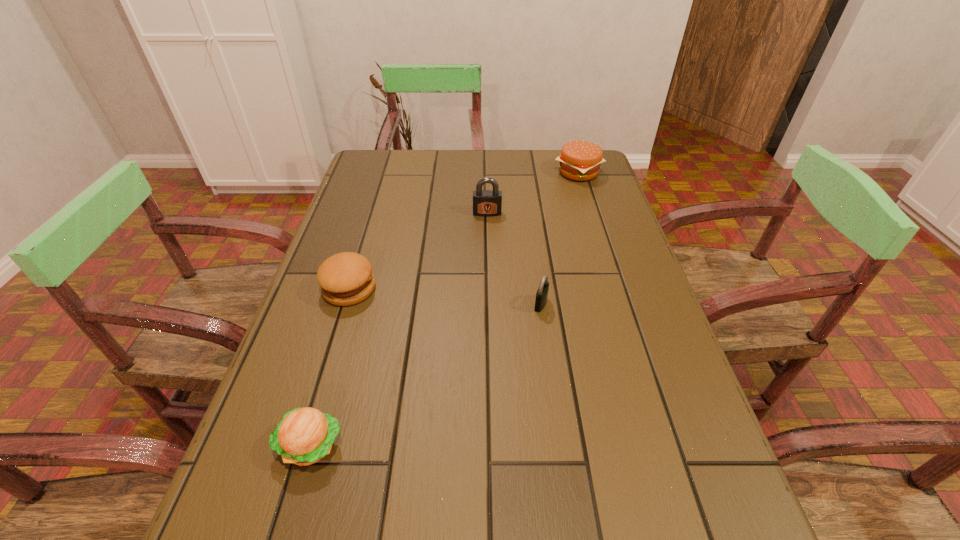
This screenshot has width=960, height=540. Identify the location of the taller padlock. (486, 203).

This screenshot has width=960, height=540. Identify the location of the left padlock. (486, 203).

Identify the location of the rightmost hamburger. The image size is (960, 540). (580, 160).

The image size is (960, 540). I want to click on the farthest object, so click(580, 160).

Where is `the second nearest hamburger`? The height and width of the screenshot is (540, 960). the second nearest hamburger is located at coordinates (346, 278).

Where is `the nearer padlock`? Image resolution: width=960 pixels, height=540 pixels. the nearer padlock is located at coordinates (542, 293).

Identify the location of the right padlock. (542, 293).

Locate an element on the screen. This screenshot has width=960, height=540. the nearest hamburger is located at coordinates (304, 436).

Identify the location of vacant area situated on the front of the second farthest object near the keyhole. This screenshot has height=540, width=960. (488, 239).

Locate an element on the screen. vacant space located 0.070m on the back of the farthest hamburger is located at coordinates (571, 151).